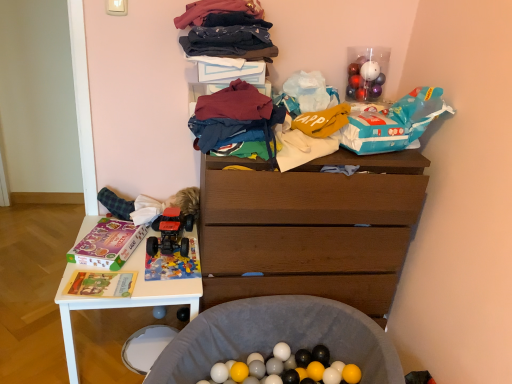
Find the location of a particular element. The image size is (512, 384). vacant space underneath matte yellow book at lower left, acting as the first magazine starting from the front (from a real-world perspective) is located at coordinates (101, 292).